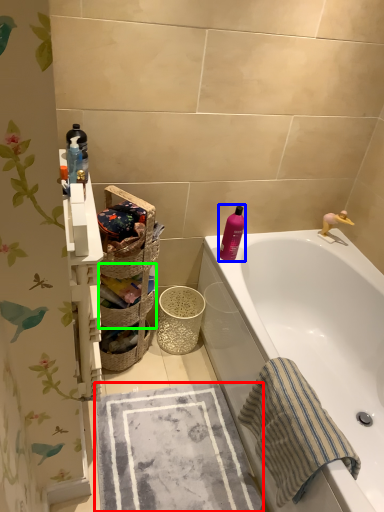
Question: Considering the real-world distances, which object is closest to beach towel (highlighted by a red box)? cleaning product (highlighted by a blue box) or basket (highlighted by a green box).

Choices:
 (A) cleaning product
 (B) basket

Answer: (B)